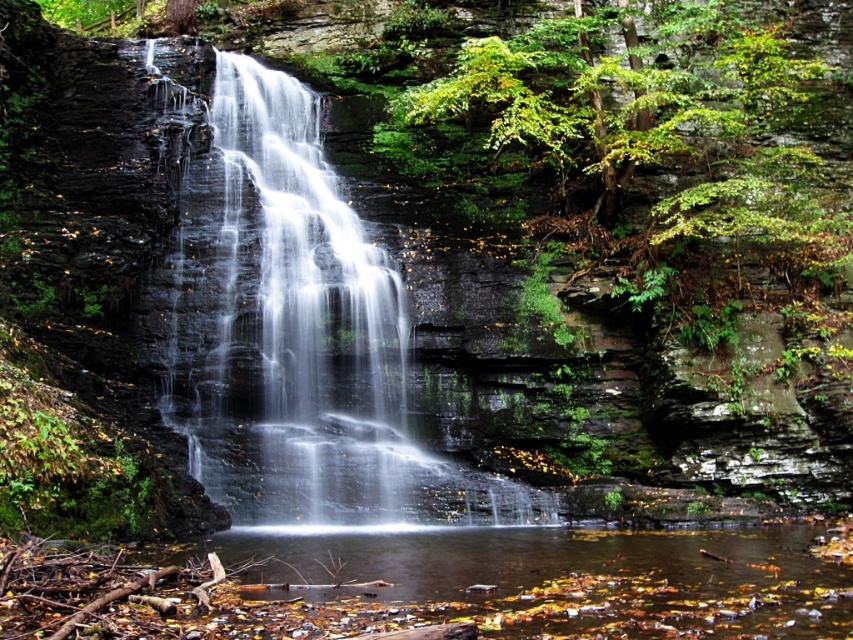
Question: Which point is farther from the camera taking this photo?

Choices:
 (A) (318, 420)
 (B) (569, 605)

Answer: (A)

Question: Observing the image, what is the correct spatial positioning of translucent white water at center in reference to clear water at center?

Choices:
 (A) left
 (B) right

Answer: (A)

Question: Can you confirm if translucent white water at center is positioned to the right of clear water at center?

Choices:
 (A) no
 (B) yes

Answer: (A)

Question: Does translucent white water at center appear on the left side of clear water at center?

Choices:
 (A) no
 (B) yes

Answer: (B)